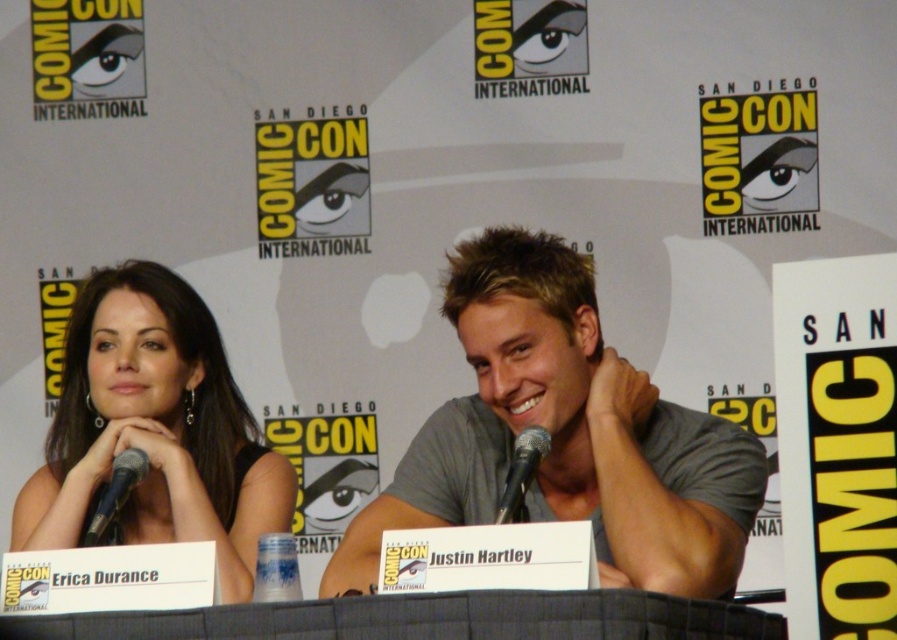
Question: Which object is closer to the camera taking this photo?

Choices:
 (A) gray cotton shirt at center
 (B) black metallic microphone at center
 (C) matte black dress at left

Answer: (A)

Question: Does gray cotton shirt at center come in front of black metallic microphone at left?

Choices:
 (A) yes
 (B) no

Answer: (A)

Question: Is matte black dress at left smaller than black metallic microphone at left?

Choices:
 (A) no
 (B) yes

Answer: (A)

Question: Which point is closer to the camera?

Choices:
 (A) gray cotton shirt at center
 (B) black metallic microphone at left

Answer: (A)

Question: Which of the following is the closest to the observer?

Choices:
 (A) (234, 593)
 (B) (512, 476)

Answer: (B)

Question: Observing the image, what is the correct spatial positioning of gray cotton shirt at center in reference to matte black dress at left?

Choices:
 (A) above
 (B) below

Answer: (A)